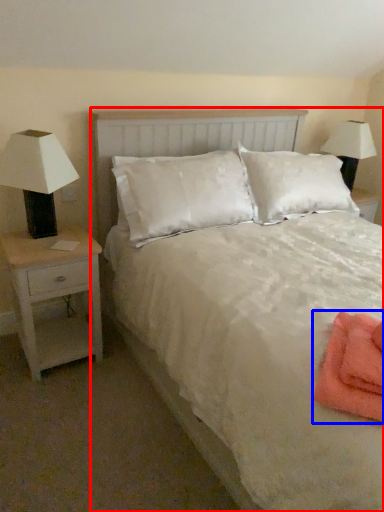
Question: Which object appears farthest to the camera in this image, bed (highlighted by a red box) or material (highlighted by a blue box)?

Choices:
 (A) bed
 (B) material

Answer: (B)